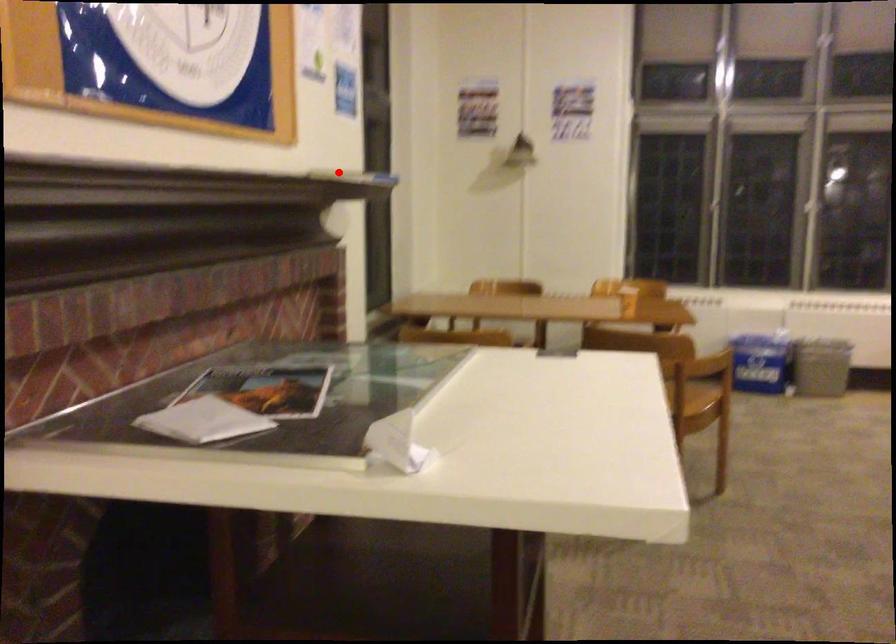
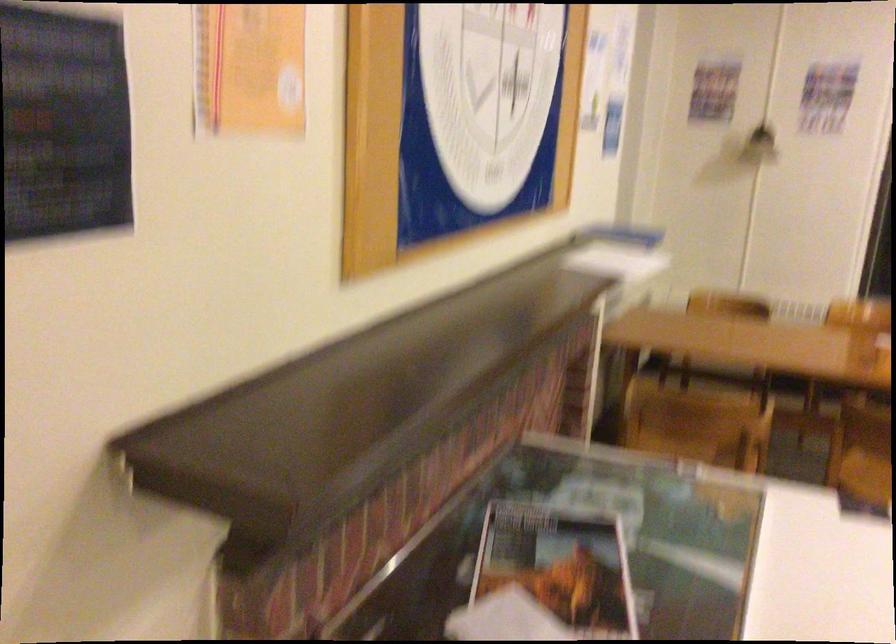
Question: I am providing you with two images of the same scene from different viewpoints. Given a red point in image1, look at the same physical point in image2. Is it:

Choices:
 (A) Closer to the viewpoint
 (B) Farther from the viewpoint

Answer: (A)